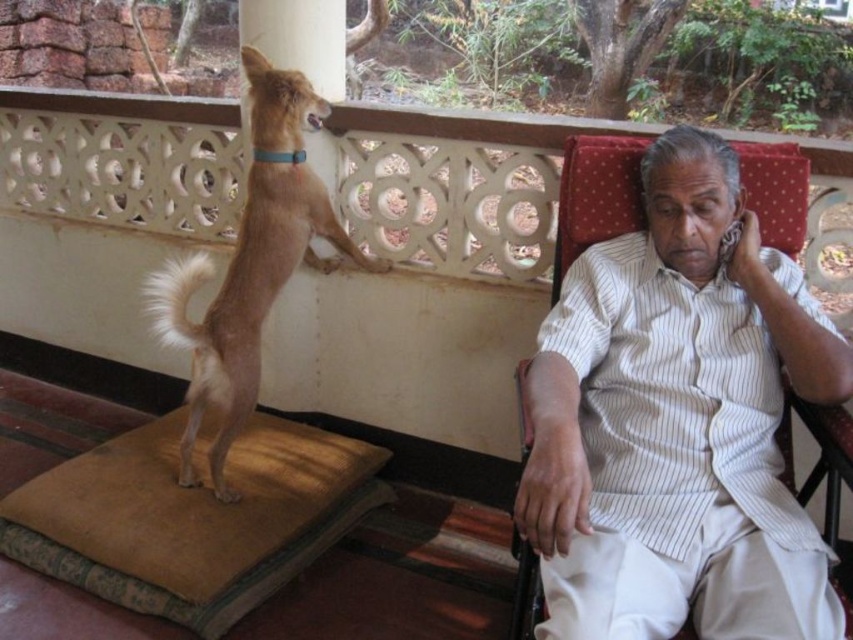
Question: In this image, where is white striped shirt at right located relative to light brown fur dog at left?

Choices:
 (A) left
 (B) right

Answer: (B)

Question: Is the position of white striped shirt at right less distant than that of light brown fur dog at left?

Choices:
 (A) no
 (B) yes

Answer: (B)

Question: Is white striped shirt at right bigger than light brown fur dog at left?

Choices:
 (A) no
 (B) yes

Answer: (A)

Question: Which object is farther from the camera taking this photo?

Choices:
 (A) white striped shirt at right
 (B) light brown fur dog at left

Answer: (B)

Question: Which of the following is the closest to the observer?

Choices:
 (A) light brown fur dog at left
 (B) white striped shirt at right

Answer: (B)